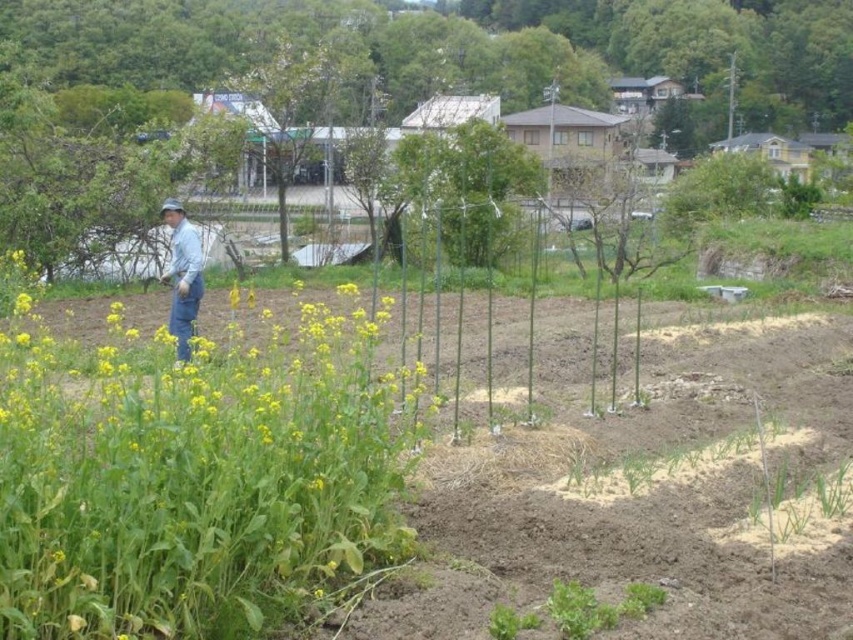
You are a farmer checking your crops. You notice two green leafy plants in the field. One is labeled as the green leafy plant at center and the other as the green leafy tree at center. Which one is narrower in width?

The green leafy plant at center is narrower in width compared to the green leafy tree at center.

You are standing at the origin point of the image coordinate system. You want to walk towards the green leafy tree at upper center. What are the coordinates you should head towards?

The coordinates you should head towards are 0.078 on the x axis and 0.559 on the y axis.